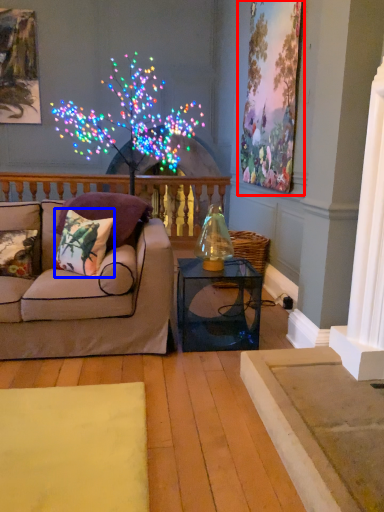
Question: Which point is further to the camera, picture frame (highlighted by a red box) or pillow (highlighted by a blue box)?

Choices:
 (A) picture frame
 (B) pillow

Answer: (A)